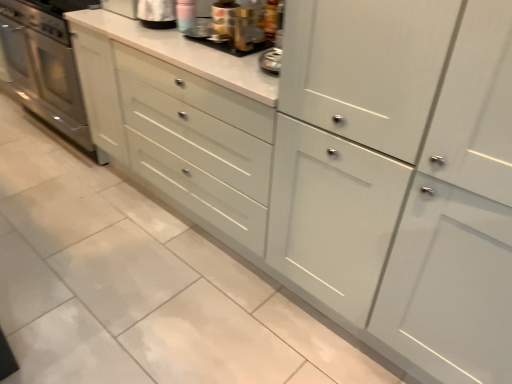
Question: Should I look upward or downward to see metallic silver toaster at upper center, which appears as the 2th appliance when viewed from the left?

Choices:
 (A) down
 (B) up

Answer: (B)

Question: Would you say stainless steel oven at left is a long distance from metallic gold coffee pot at upper center, the 3th appliance positioned from the left?

Choices:
 (A) yes
 (B) no

Answer: (A)

Question: Is stainless steel oven at left looking in the opposite direction of metallic gold coffee pot at upper center, the 3th appliance positioned from the left?

Choices:
 (A) no
 (B) yes

Answer: (A)

Question: Is stainless steel oven at left next to metallic gold coffee pot at upper center, the 1th appliance when ordered from right to left, and touching it?

Choices:
 (A) no
 (B) yes

Answer: (A)

Question: From the image's perspective, would you say stainless steel oven at left is positioned over metallic gold coffee pot at upper center, the 3th appliance positioned from the left?

Choices:
 (A) yes
 (B) no

Answer: (A)

Question: Is stainless steel oven at left outside of metallic gold coffee pot at upper center, the 1th appliance when ordered from right to left?

Choices:
 (A) no
 (B) yes

Answer: (B)

Question: Does stainless steel oven at left have a lesser height compared to metallic gold coffee pot at upper center, the 3th appliance positioned from the left?

Choices:
 (A) yes
 (B) no

Answer: (B)

Question: From a real-world perspective, is metallic gold coffee pot at upper center, the 3th appliance positioned from the left, below metallic silver toaster at upper center, positioned as the 1th appliance in left-to-right order?

Choices:
 (A) no
 (B) yes

Answer: (A)

Question: Can you confirm if metallic gold coffee pot at upper center, the 1th appliance when ordered from right to left, is positioned to the left of metallic silver toaster at upper center, positioned as the 1th appliance in left-to-right order?

Choices:
 (A) no
 (B) yes

Answer: (A)

Question: Is the depth of metallic gold coffee pot at upper center, the 3th appliance positioned from the left, greater than that of metallic silver toaster at upper center, positioned as the 1th appliance in left-to-right order?

Choices:
 (A) yes
 (B) no

Answer: (B)

Question: Is metallic gold coffee pot at upper center, the 3th appliance positioned from the left, outside of metallic silver toaster at upper center, positioned as the 1th appliance in left-to-right order?

Choices:
 (A) no
 (B) yes

Answer: (B)

Question: From a real-world perspective, is metallic gold coffee pot at upper center, the 3th appliance positioned from the left, located higher than metallic silver toaster at upper center, which is the third appliance from right to left?

Choices:
 (A) yes
 (B) no

Answer: (A)

Question: Does metallic gold coffee pot at upper center, the 1th appliance when ordered from right to left, turn towards metallic silver toaster at upper center, which is the third appliance from right to left?

Choices:
 (A) yes
 (B) no

Answer: (B)

Question: Considering the relative sizes of metallic silver toaster at upper center, the 2th appliance viewed from the right, and stainless steel oven at left in the image provided, is metallic silver toaster at upper center, the 2th appliance viewed from the right, smaller than stainless steel oven at left?

Choices:
 (A) yes
 (B) no

Answer: (A)